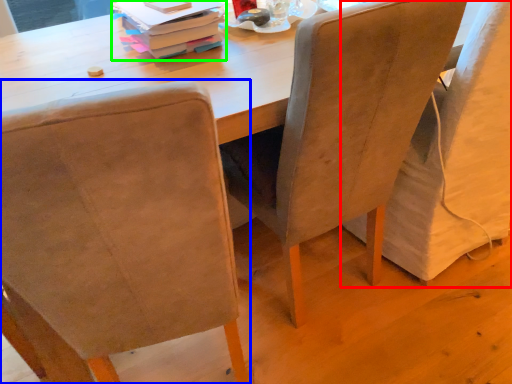
Question: Considering the real-world distances, which object is farthest from chair (highlighted by a red box)? chair (highlighted by a blue box) or book (highlighted by a green box)?

Choices:
 (A) chair
 (B) book

Answer: (A)